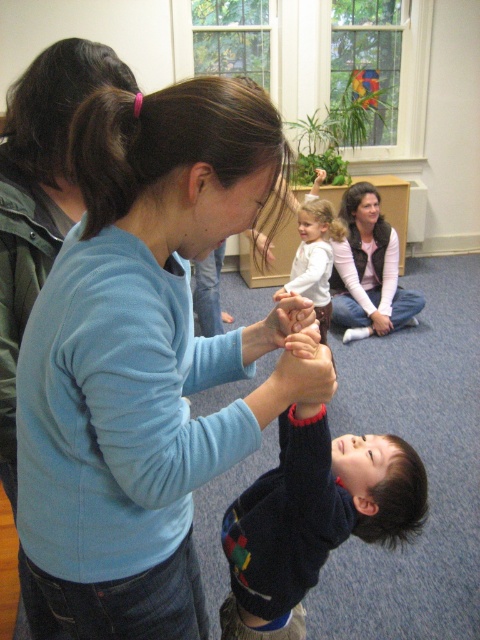
Can you confirm if blue matte sweater at center is bigger than dark blue sweater at center?

No.

Between point (23, 515) and point (372, 492), which one is positioned in front?

Point (23, 515)

At what (x,y) coordinates should I click in order to perform the action: click on blue matte sweater at center. Please return your answer as a coordinate pair (x, y). Looking at the image, I should click on (145, 356).

Is matte pink sweater at upper right thinner than white soft shirt at center?

No.

Which is below, matte pink sweater at upper right or white soft shirt at center?

white soft shirt at center

Where is `matte pink sweater at upper right`? Image resolution: width=480 pixels, height=640 pixels. matte pink sweater at upper right is located at coordinates (369, 268).

Which of these two, dark blue sweater at center or matte pink sweater at upper right, stands taller?

matte pink sweater at upper right

Which is more to the left, dark blue sweater at center or matte pink sweater at upper right?

dark blue sweater at center

Find the location of `dark blue sweater at center`. dark blue sweater at center is located at coordinates (312, 516).

This screenshot has height=640, width=480. I want to click on dark blue sweater at center, so click(x=312, y=516).